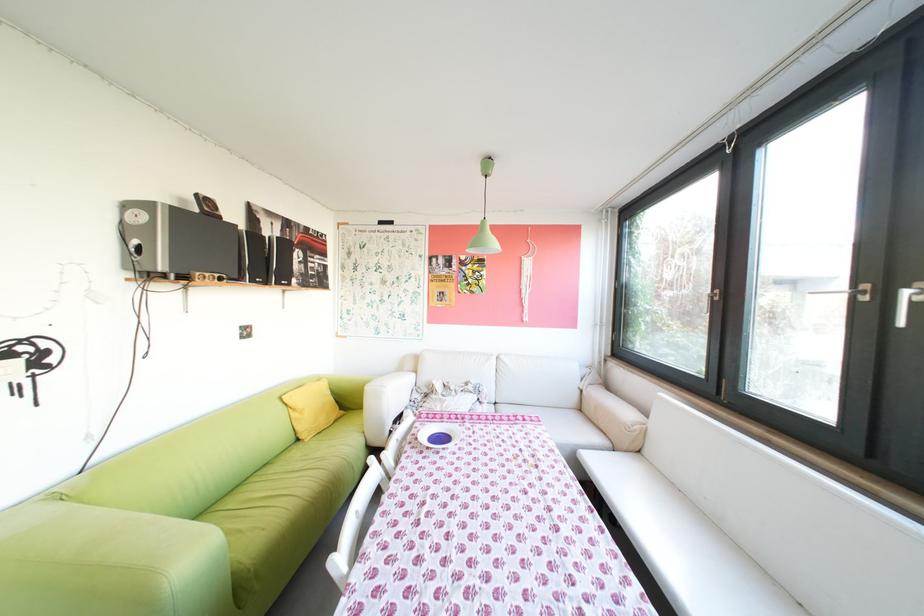
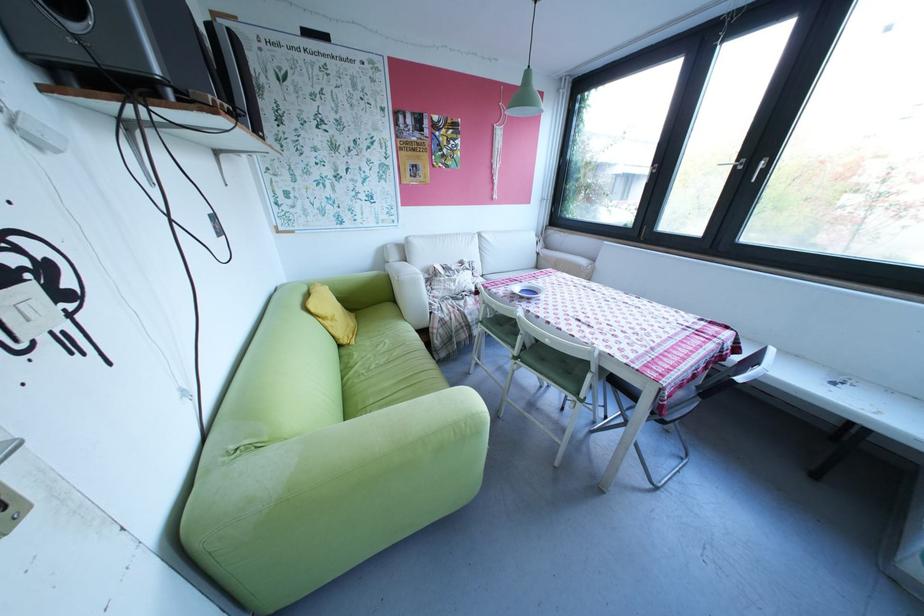
Locate, in the second image, the point that corresponds to point 321,440 in the first image.

(366, 342)